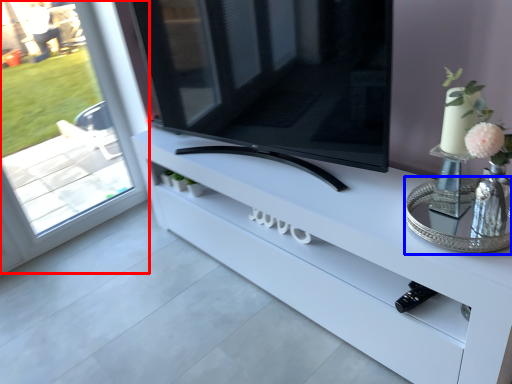
Question: Which of the following is the farthest to the observer, window (highlighted by a red box) or glass table (highlighted by a blue box)?

Choices:
 (A) window
 (B) glass table

Answer: (A)